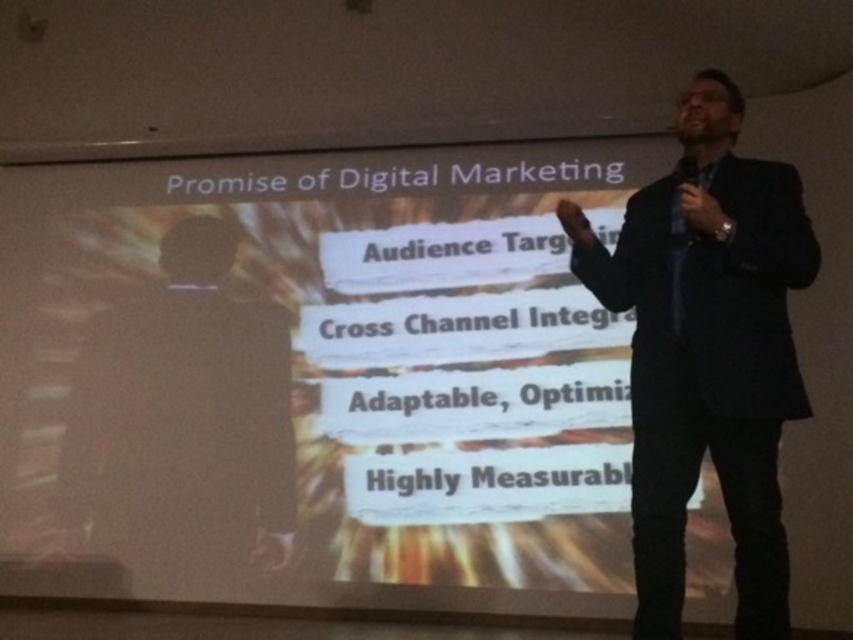
You are an event planner checking the setup for a presentation. You need to ensure that the white matte projector screen at upper center and the black suit at center are positioned correctly. Based on the scene description, which object is wider?

The white matte projector screen at upper center is wider than the black suit at center.

You are an event planner setting up a presentation. You have a white matte projector screen at upper center and a dark blue suit at center. Which object is larger in the image?

The white matte projector screen at upper center is bigger than the dark blue suit at center.